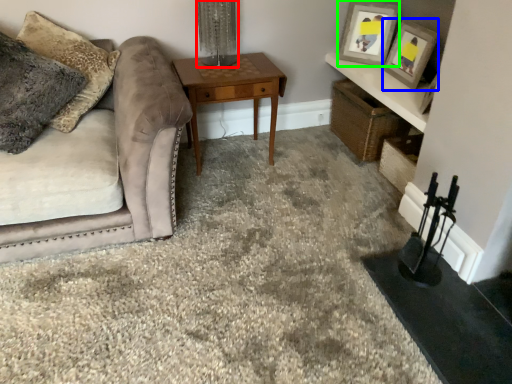
Question: Which object is the closest to the table lamp (highlighted by a red box)? Choose among these: picture frame (highlighted by a blue box) or picture frame (highlighted by a green box).

Choices:
 (A) picture frame
 (B) picture frame

Answer: (B)